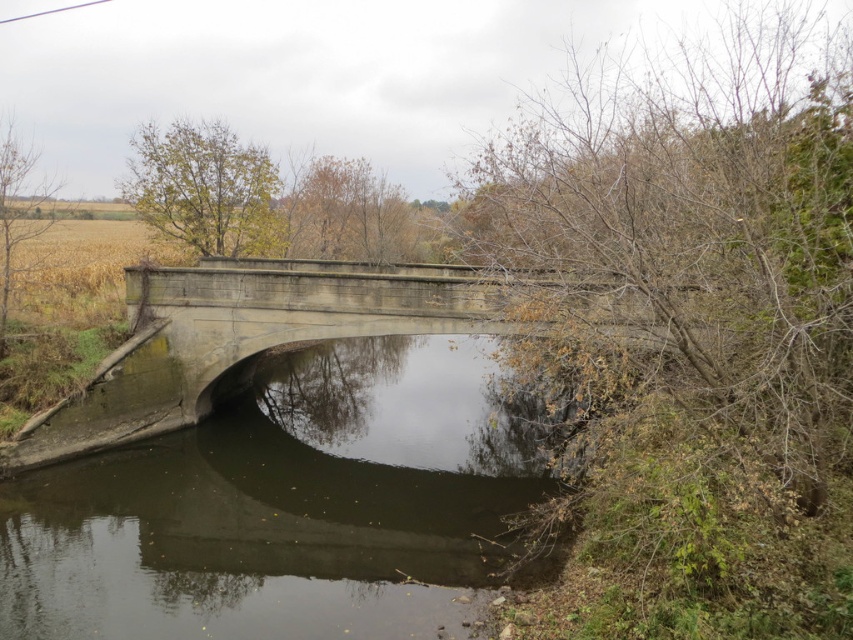
You are standing on the gray concrete bridge at center and want to see the dark gray concrete river at center below you. Which object is closer to your eyes when looking down?

The gray concrete bridge at center is closer to your eyes than the dark gray concrete river at center because the river is further away from the viewer.

You are a photographer planning to capture the entire scene of the dark gray concrete river at center and the gray concrete bridge at center in a single shot. Based on their sizes, which one would appear more prominent in the photo?

The dark gray concrete river at center has a larger size compared to the gray concrete bridge at center, so it would appear more prominent in the photo.

You are a delivery drone that needs to fly over the dark gray concrete river at center and the gray concrete bridge at center. Which object should you avoid flying under to prevent collision?

You should avoid flying under the gray concrete bridge at center because the dark gray concrete river at center is below the gray concrete bridge at center, meaning the bridge is above the river and could obstruct the drone if flown under it.